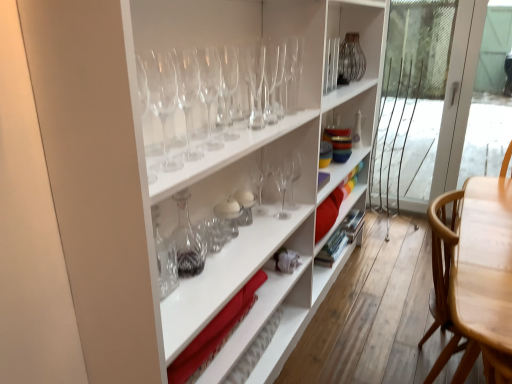
Image resolution: width=512 pixels, height=384 pixels. What are the coordinates of `free spot behind light brown wood chair at right` in the screenshot? It's located at (395, 330).